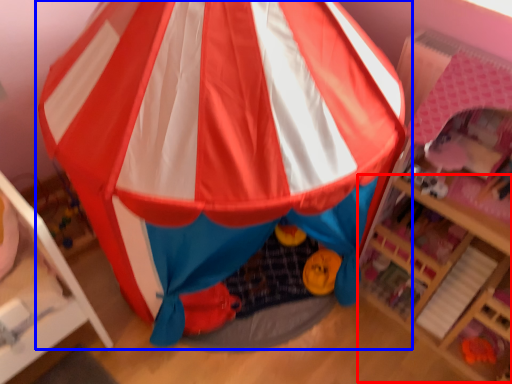
Question: Among these objects, which one is farthest to the camera, shelf (highlighted by a red box) or tent (highlighted by a blue box)?

Choices:
 (A) shelf
 (B) tent

Answer: (A)